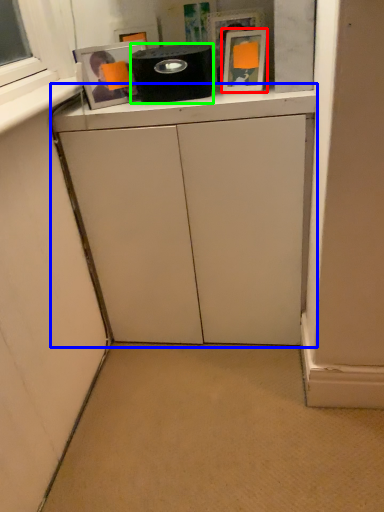
Question: Based on their relative distances, which object is farther from picture frame (highlighted by a red box)? Choose from cabinetry (highlighted by a blue box) and appliance (highlighted by a green box).

Choices:
 (A) cabinetry
 (B) appliance

Answer: (A)